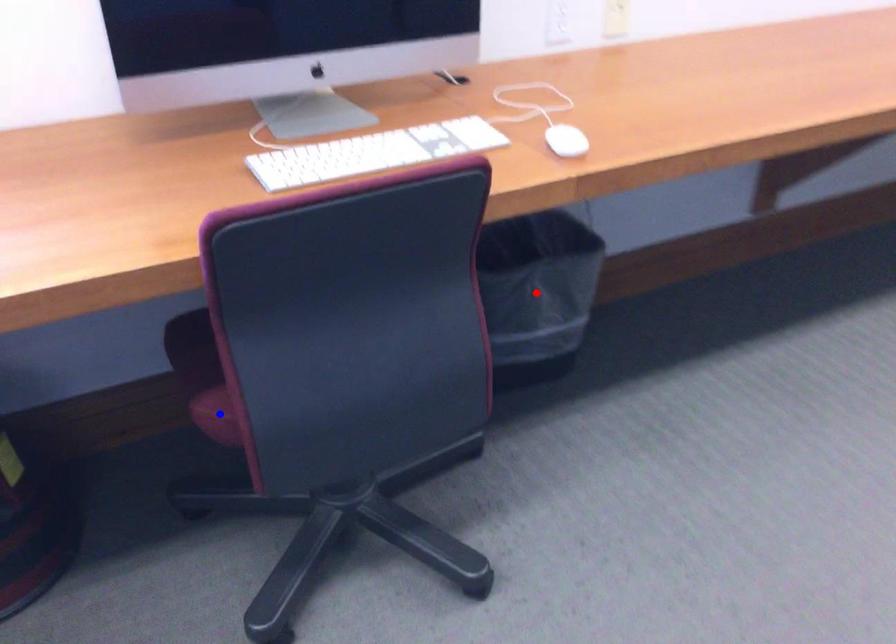
Question: Which of the two points in the image is closer to the camera?

Choices:
 (A) Blue point is closer.
 (B) Red point is closer.

Answer: (A)